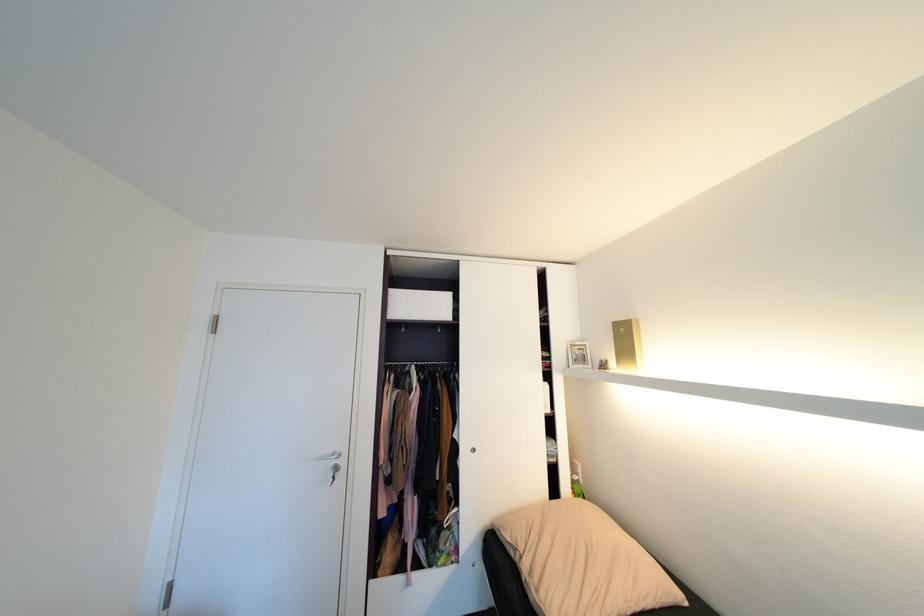
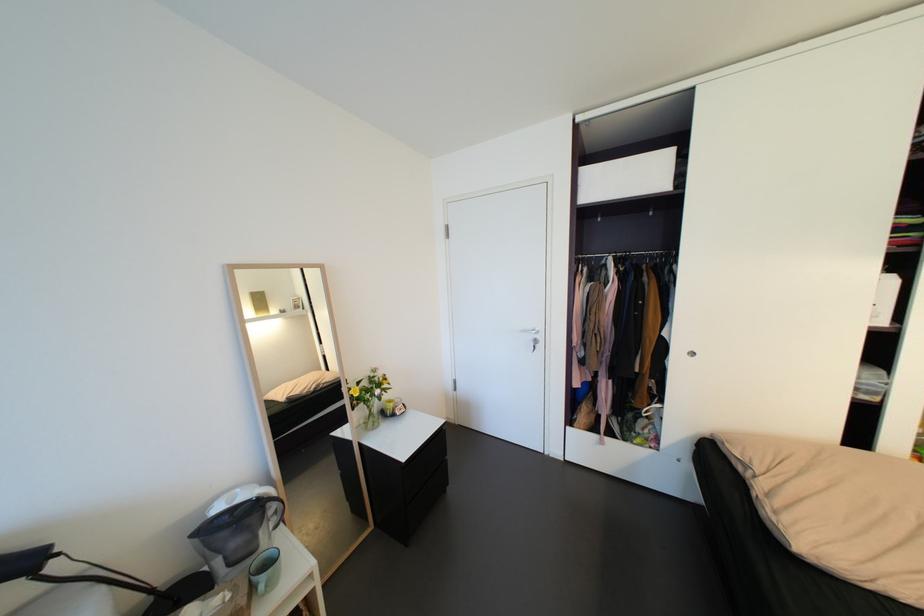
In the second image, find the point that corresponds to the point at 488,568 in the first image.

(697, 467)